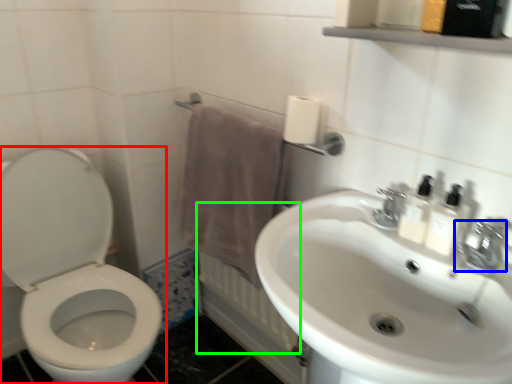
Question: Which is nearer to the toilet (highlighted by a red box)? tap (highlighted by a blue box) or radiator (highlighted by a green box).

Choices:
 (A) tap
 (B) radiator

Answer: (B)